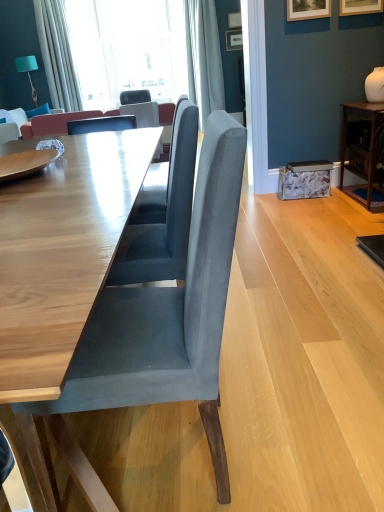
You are a GUI agent. You are given a task and a screenshot of the screen. Output one action in this format:
    pyautogui.click(x=<x>, y=<y>)
    Task: Click on the free spot to the left of dark wood table at right, marked as the 1th table in a right-to-left arrangement
    Image resolution: width=384 pixels, height=512 pixels.
    Given the screenshot: What is the action you would take?
    pyautogui.click(x=324, y=209)